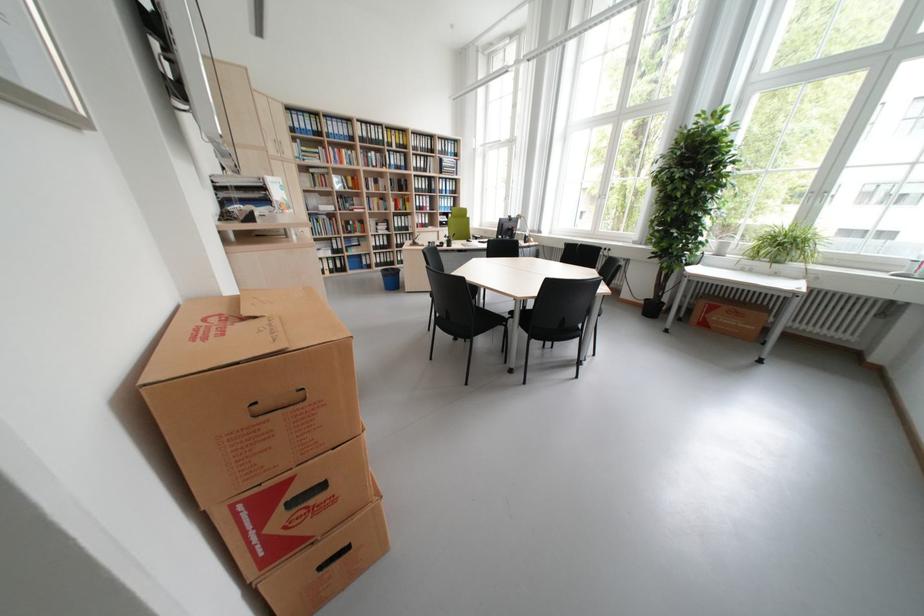
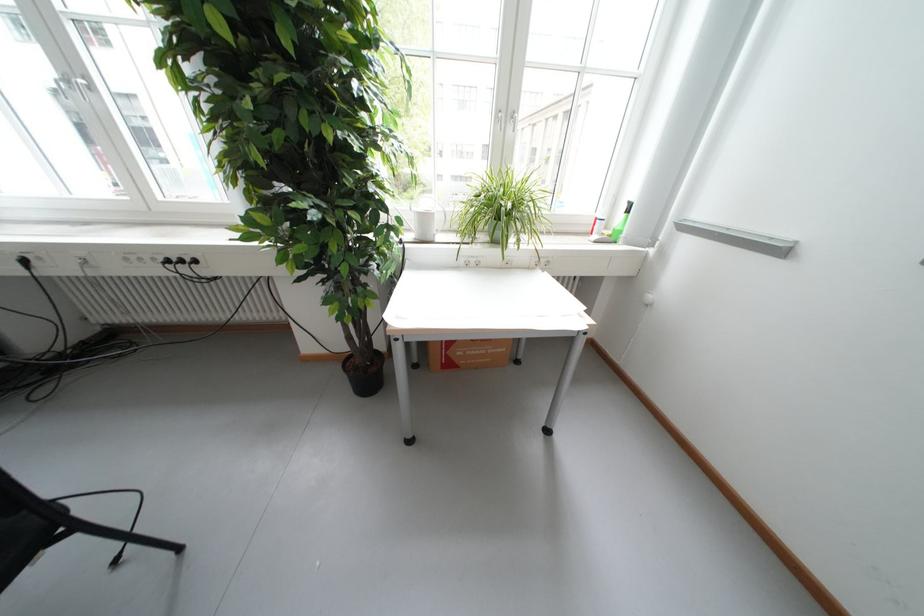
Locate, in the second image, the point that corresponds to the point at 734,246 in the first image.

(435, 220)